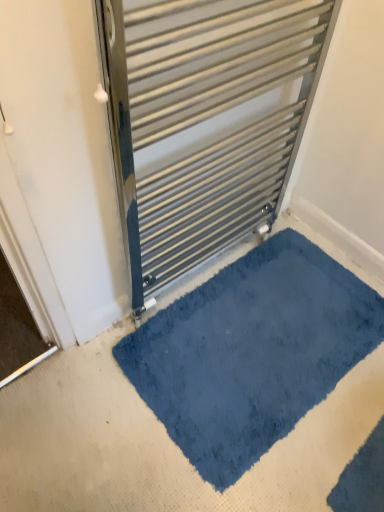
Question: From the image's perspective, is blue plush bath mat at lower center located above or below metallic silver radiator at center?

Choices:
 (A) above
 (B) below

Answer: (B)

Question: Is blue plush bath mat at lower center bigger or smaller than metallic silver radiator at center?

Choices:
 (A) big
 (B) small

Answer: (B)

Question: Is blue plush bath mat at lower center inside the boundaries of metallic silver radiator at center, or outside?

Choices:
 (A) outside
 (B) inside

Answer: (A)

Question: Is metallic silver radiator at center inside the boundaries of blue plush bath mat at lower center, or outside?

Choices:
 (A) outside
 (B) inside

Answer: (A)

Question: Based on their sizes in the image, would you say metallic silver radiator at center is bigger or smaller than blue plush bath mat at lower center?

Choices:
 (A) big
 (B) small

Answer: (A)

Question: Does point (195, 48) appear closer or farther from the camera than point (144, 372)?

Choices:
 (A) closer
 (B) farther

Answer: (A)

Question: Is metallic silver radiator at center wider or thinner than blue plush bath mat at lower center?

Choices:
 (A) wide
 (B) thin

Answer: (B)